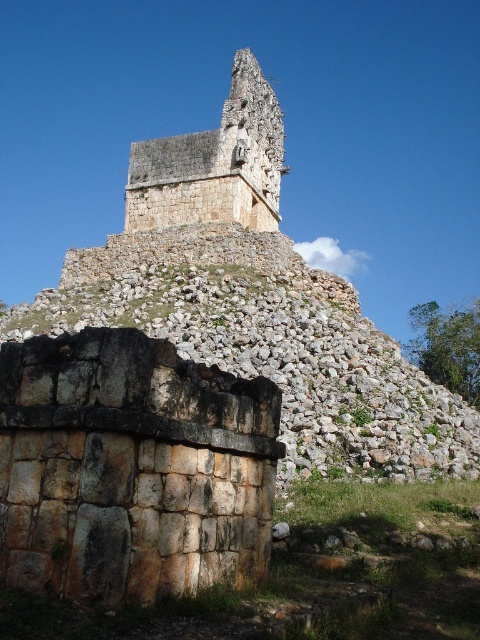
You are an archaeologist examining the ancient stone ruins. You notice the rustic stone wall at lower left and the rough stone structure at upper center. Which of these two objects is nearer to your current position?

The rustic stone wall at lower left is closer to the viewer than the rough stone structure at upper center, so the rustic stone wall at lower left is nearer to your current position.